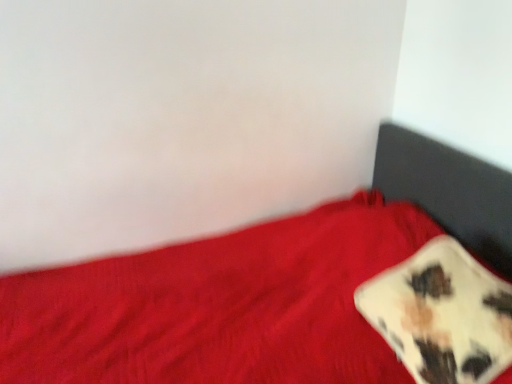
Describe the element at coordinates (442, 314) in the screenshot. This screenshot has height=384, width=512. I see `cow print fabric pillow at lower right` at that location.

At what (x,y) coordinates should I click in order to perform the action: click on cow print fabric pillow at lower right. Please return your answer as a coordinate pair (x, y). Image resolution: width=512 pixels, height=384 pixels. Looking at the image, I should click on (442, 314).

Find the location of a particular element. red fabric bed at lower right is located at coordinates (257, 286).

The image size is (512, 384). Describe the element at coordinates (257, 286) in the screenshot. I see `red fabric bed at lower right` at that location.

The height and width of the screenshot is (384, 512). What are the coordinates of `cow print fabric pillow at lower right` in the screenshot? It's located at (442, 314).

Which is more to the left, cow print fabric pillow at lower right or red fabric bed at lower right?

red fabric bed at lower right.

Does cow print fabric pillow at lower right lie in front of red fabric bed at lower right?

No, it is not.

Considering the positions of points (376, 283) and (448, 175), is point (376, 283) closer to camera compared to point (448, 175)?

Yes, it is.

From the image's perspective, is cow print fabric pillow at lower right located above or below red fabric bed at lower right?

Based on their image positions, cow print fabric pillow at lower right is located above red fabric bed at lower right.

From a real-world perspective, is cow print fabric pillow at lower right physically located above or below red fabric bed at lower right?

In terms of real-world spatial position, cow print fabric pillow at lower right is above red fabric bed at lower right.

Between cow print fabric pillow at lower right and red fabric bed at lower right, which one has larger width?

red fabric bed at lower right is wider.

From the picture: Considering the relative sizes of cow print fabric pillow at lower right and red fabric bed at lower right in the image provided, is cow print fabric pillow at lower right taller than red fabric bed at lower right?

No.

Based on their sizes in the image, would you say cow print fabric pillow at lower right is bigger or smaller than red fabric bed at lower right?

Clearly, cow print fabric pillow at lower right is smaller in size than red fabric bed at lower right.

Would you say cow print fabric pillow at lower right is outside red fabric bed at lower right?

No, cow print fabric pillow at lower right is inside red fabric bed at lower right's boundary.

Is cow print fabric pillow at lower right far away from red fabric bed at lower right?

No, cow print fabric pillow at lower right is not far from red fabric bed at lower right.

Is cow print fabric pillow at lower right oriented away from red fabric bed at lower right?

Absolutely, cow print fabric pillow at lower right is directed away from red fabric bed at lower right.

What's the angular difference between cow print fabric pillow at lower right and red fabric bed at lower right's facing directions?

The angular difference between cow print fabric pillow at lower right and red fabric bed at lower right is 0.685 degrees.

Where is `pillow that appears above the red fabric bed at lower right (from a real-world perspective)`? pillow that appears above the red fabric bed at lower right (from a real-world perspective) is located at coordinates (442, 314).

Looking at this image, does red fabric bed at lower right appear on the right side of cow print fabric pillow at lower right?

No, red fabric bed at lower right is not to the right of cow print fabric pillow at lower right.

Is red fabric bed at lower right in front of or behind cow print fabric pillow at lower right in the image?

Visually, red fabric bed at lower right is located in front of cow print fabric pillow at lower right.

Which point is more forward, (401,180) or (434,382)?

Positioned in front is point (434,382).

From the image's perspective, is red fabric bed at lower right located above cow print fabric pillow at lower right?

Actually, red fabric bed at lower right appears below cow print fabric pillow at lower right in the image.

From a real-world perspective, is red fabric bed at lower right on top of cow print fabric pillow at lower right?

Incorrect, from a real-world perspective, red fabric bed at lower right is lower than cow print fabric pillow at lower right.

From the picture: Which of these two, red fabric bed at lower right or cow print fabric pillow at lower right, is thinner?

Thinner between the two is cow print fabric pillow at lower right.

Based on the photo, is red fabric bed at lower right shorter than cow print fabric pillow at lower right?

In fact, red fabric bed at lower right may be taller than cow print fabric pillow at lower right.

Can you confirm if red fabric bed at lower right is bigger than cow print fabric pillow at lower right?

Yes.

Is red fabric bed at lower right inside or outside of cow print fabric pillow at lower right?

red fabric bed at lower right cannot be found inside cow print fabric pillow at lower right.

Can you see red fabric bed at lower right touching cow print fabric pillow at lower right?

red fabric bed at lower right is not next to cow print fabric pillow at lower right, and they're not touching.

From the picture: Is cow print fabric pillow at lower right at the back of red fabric bed at lower right?

Correct, red fabric bed at lower right is looking away from cow print fabric pillow at lower right.

Can you tell me how much red fabric bed at lower right and cow print fabric pillow at lower right differ in facing direction?

The angular difference between red fabric bed at lower right and cow print fabric pillow at lower right is 0.685 degrees.

How distant is red fabric bed at lower right from cow print fabric pillow at lower right?

The distance of red fabric bed at lower right from cow print fabric pillow at lower right is 8.86 inches.

The height and width of the screenshot is (384, 512). I want to click on bed in front of the cow print fabric pillow at lower right, so click(x=257, y=286).

Locate an element on the screen. The width and height of the screenshot is (512, 384). pillow above the red fabric bed at lower right (from a real-world perspective) is located at coordinates (442, 314).

Where is `bed that appears below the cow print fabric pillow at lower right (from a real-world perspective)`? The width and height of the screenshot is (512, 384). bed that appears below the cow print fabric pillow at lower right (from a real-world perspective) is located at coordinates (257, 286).